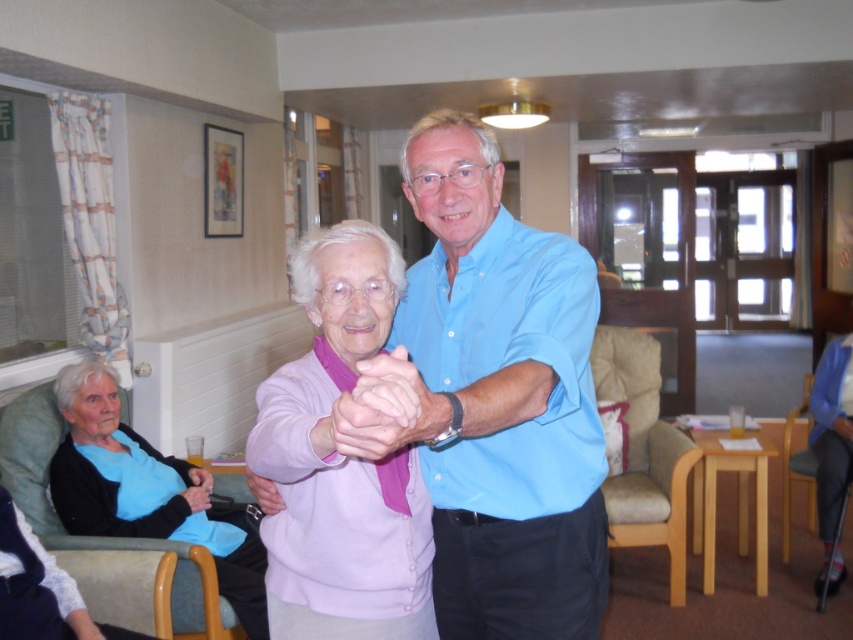
Is blue cotton shirt at center wider than pink fabric hand at center?

Yes.

Who is more forward, (500, 481) or (337, 449)?

Point (337, 449)

Find the location of `blue cotton shirt at center`. blue cotton shirt at center is located at coordinates (502, 400).

Is matte pink sweater at center positioned before matte blue fabric at lower left?

Yes, it is.

This screenshot has width=853, height=640. Find the location of `matte pink sweater at center`. matte pink sweater at center is located at coordinates (264, 492).

Find the location of a particular element. matte pink sweater at center is located at coordinates (264, 492).

Can you confirm if light blue fabric shirt at lower left is positioned above black leather hand at lower left?

No.

Is light blue fabric shirt at lower left positioned before black leather hand at lower left?

Yes, light blue fabric shirt at lower left is in front of black leather hand at lower left.

Is point (68, 456) less distant than point (198, 486)?

Yes, point (68, 456) is in front of point (198, 486).

You are a GUI agent. You are given a task and a screenshot of the screen. Output one action in this format:
    pyautogui.click(x=<x>, y=<y>)
    Task: Click on the light blue fabric shirt at lower left
    The width and height of the screenshot is (853, 640).
    Given the screenshot: What is the action you would take?
    pyautogui.click(x=142, y=490)